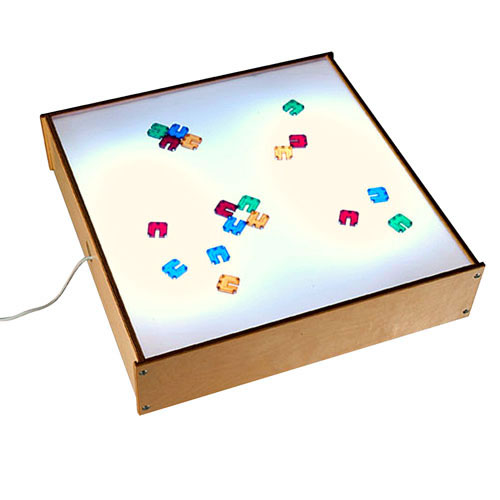
Locate an element on the screen. This screenshot has width=500, height=500. light box top is located at coordinates (322, 245).